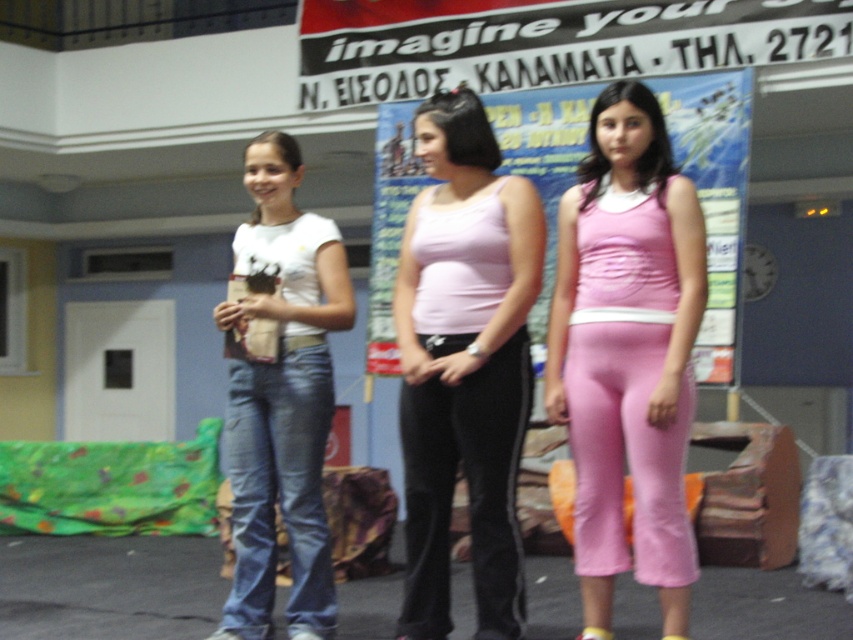
Does pink fabric tank top at center have a larger size compared to blue denim jeans at left?

Indeed, pink fabric tank top at center has a larger size compared to blue denim jeans at left.

Find the location of a particular element. The height and width of the screenshot is (640, 853). pink fabric tank top at center is located at coordinates (627, 353).

This screenshot has width=853, height=640. Identify the location of pink fabric tank top at center. (627, 353).

This screenshot has width=853, height=640. I want to click on pink matte tank top at center, so tap(463, 364).

Does pink matte tank top at center appear under denim jeans at center?

Actually, pink matte tank top at center is above denim jeans at center.

Locate an element on the screen. The image size is (853, 640). pink matte tank top at center is located at coordinates (463, 364).

Which is behind, point (607, 484) or point (253, 257)?

The point (253, 257) is more distant.

What do you see at coordinates (627, 353) in the screenshot?
I see `pink fabric tank top at center` at bounding box center [627, 353].

Find the location of `pink fabric tank top at center`. pink fabric tank top at center is located at coordinates (627, 353).